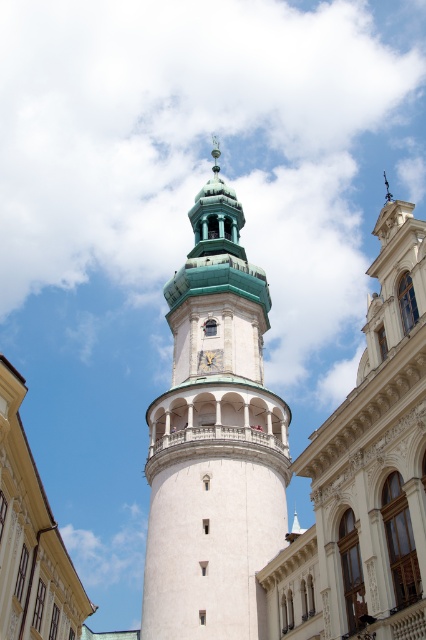
Question: Which of the following is the closest to the observer?

Choices:
 (A) (209, 362)
 (B) (420, 595)
 (C) (264, 320)

Answer: (B)

Question: Does white stone tower at center appear over gold textured clock at center?

Choices:
 (A) yes
 (B) no

Answer: (A)

Question: Which of the following is the closest to the observer?

Choices:
 (A) (183, 298)
 (B) (322, 452)
 (C) (209, 365)

Answer: (B)

Question: Is white stone tower at center above gold textured clock at center?

Choices:
 (A) no
 (B) yes

Answer: (B)

Question: Among these points, which one is nearest to the camera?

Choices:
 (A) (311, 476)
 (B) (250, 420)
 (C) (199, 353)

Answer: (A)

Question: Is white stone tower at center positioned in front of gold textured clock at center?

Choices:
 (A) yes
 (B) no

Answer: (A)